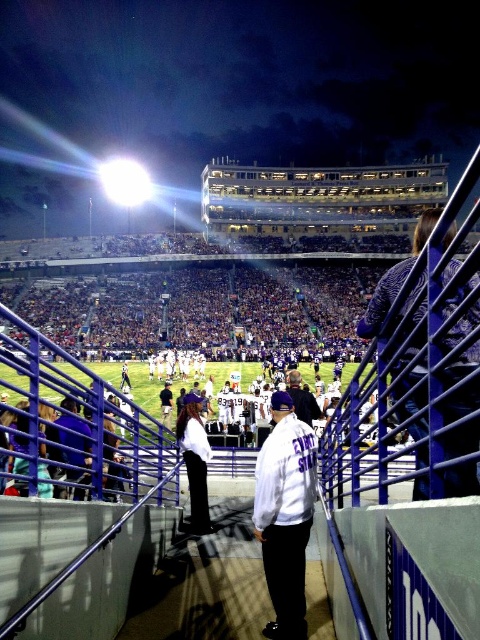
Question: Which object is the closest to the white shirt at center?

Choices:
 (A) patterned fabric jacket at right
 (B) white matte jacket at center

Answer: (B)

Question: Which point is farther to the camera?

Choices:
 (A) white shirt at center
 (B) white matte jacket at center
 (C) patterned fabric jacket at right

Answer: (A)

Question: Does patterned fabric jacket at right have a lesser width compared to white matte jacket at center?

Choices:
 (A) yes
 (B) no

Answer: (B)

Question: Which is farther from the patterned fabric jacket at right?

Choices:
 (A) white matte jacket at center
 (B) white shirt at center

Answer: (B)

Question: Is white matte jacket at center further to the viewer compared to white shirt at center?

Choices:
 (A) no
 (B) yes

Answer: (A)

Question: Can you confirm if white matte jacket at center is positioned to the left of white shirt at center?

Choices:
 (A) yes
 (B) no

Answer: (B)